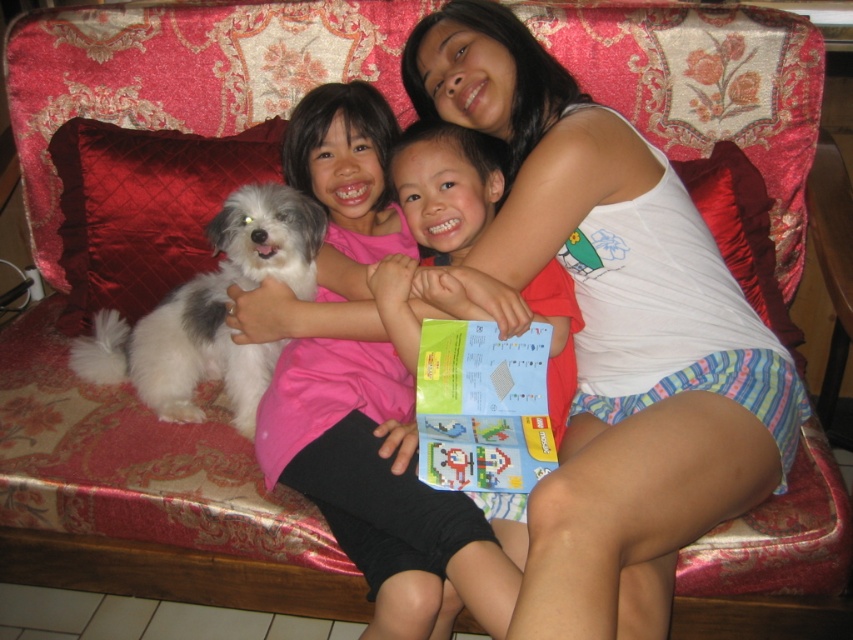
Looking at the scene, which object is taller between the white cotton tank top at upper center and the velvet red pillow at left?

The white cotton tank top at upper center is taller than the velvet red pillow at left according to the description.

What are the coordinates of the white cotton tank top at upper center?

The white cotton tank top at upper center is located at coordinates point (x=610, y=332).

You are a photographer setting up for a group photo. You have a camera with a 50 cm focal length lens. You need to ensure that the white cotton tank top at upper center and the velvet red pillow at left are both in focus. Given their distance apart, will the depth of field allow both to be sharp?

The white cotton tank top at upper center and the velvet red pillow at left are 65.22 centimeters apart. Since the distance between them exceeds the typical depth of field range for a 50 cm focal length lens, it might be challenging to keep both in sharp focus simultaneously. Consider using a smaller aperture or adjusting their positions to be closer together.